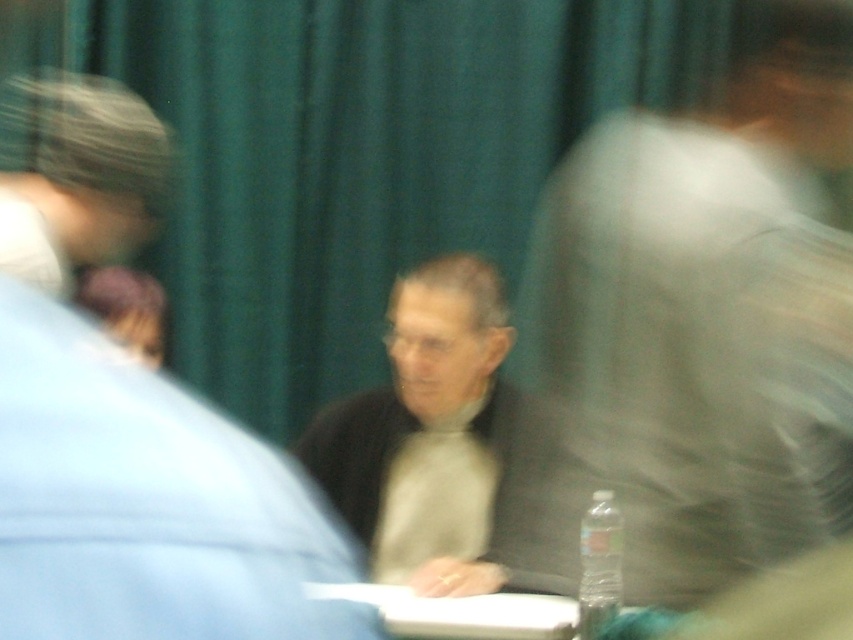
Does gray wool sweater at center have a greater height compared to clear plastic bottle at center?

Yes, gray wool sweater at center is taller than clear plastic bottle at center.

Measure the distance between point (488, 524) and camera.

The distance of point (488, 524) from camera is 2.22 meters.

Identify the location of gray wool sweater at center. The width and height of the screenshot is (853, 640). (434, 440).

Who is taller, white plastic table at center or clear plastic bottle at center?

clear plastic bottle at center

Is point (531, 628) positioned behind point (598, 586)?

Yes, it is behind point (598, 586).

Locate an element on the screen. white plastic table at center is located at coordinates (459, 612).

Which of these two, light gray sweater at center or gray wool sweater at center, stands shorter?

With less height is gray wool sweater at center.

Which is above, light gray sweater at center or gray wool sweater at center?

light gray sweater at center is above.

Is point (706, 500) positioned behind point (456, 424)?

No, it is in front of (456, 424).

Locate an element on the screen. The height and width of the screenshot is (640, 853). light gray sweater at center is located at coordinates (698, 323).